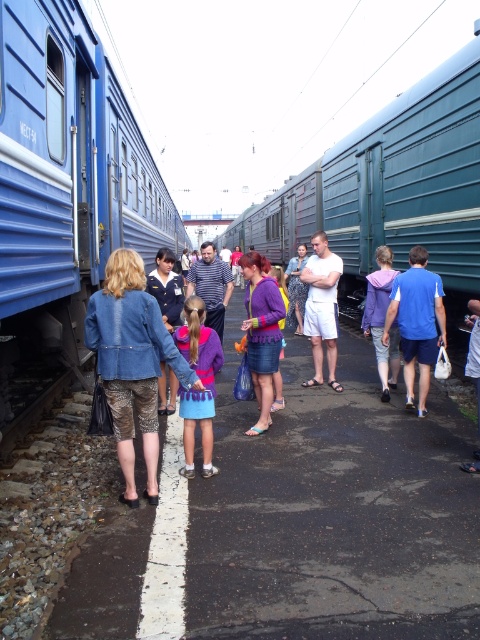
Does blue fabric shirt at right appear over purple matte sweater at center?

Actually, blue fabric shirt at right is below purple matte sweater at center.

Which is in front, point (418, 268) or point (248, 336)?

Point (248, 336)

Does point (411, 307) come closer to viewer compared to point (256, 285)?

No.

Locate an element on the screen. The image size is (480, 640). blue fabric shirt at right is located at coordinates coord(417,323).

Identify the location of blue fabric shirt at right. This screenshot has width=480, height=640. (417, 323).

Is purple matte sweater at center below purple fleece jacket at center?

No.

Is the position of purple matte sweater at center more distant than that of purple fleece jacket at center?

No, it is not.

Between point (259, 330) and point (368, 300), which one is positioned behind?

The point (368, 300) is more distant.

Find the location of a particular element. This screenshot has width=480, height=640. purple matte sweater at center is located at coordinates (262, 332).